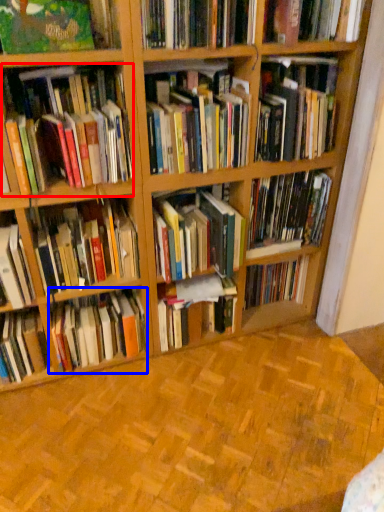
Question: Which of the following is the farthest to the observer, book (highlighted by a red box) or book (highlighted by a blue box)?

Choices:
 (A) book
 (B) book

Answer: (B)